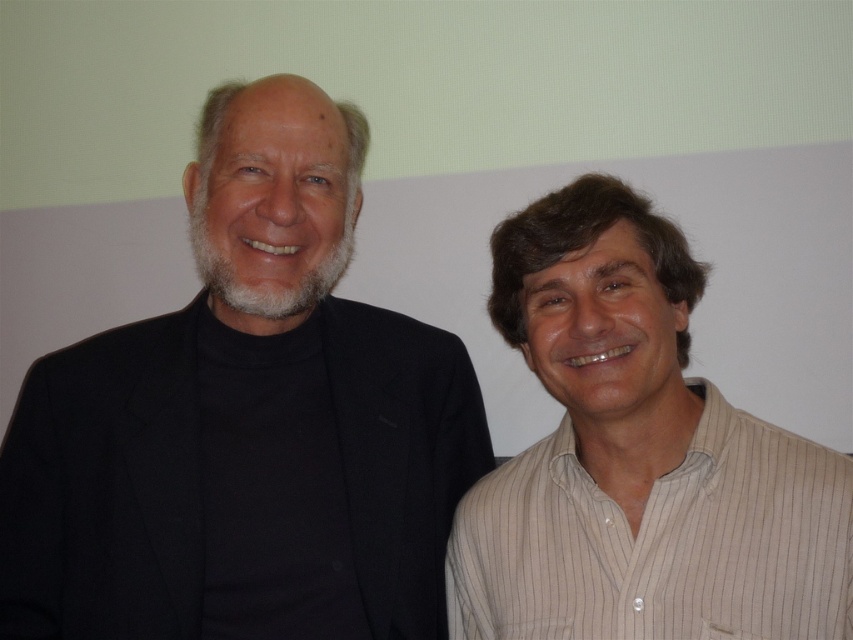
Question: Is black matte suit at left in front of white striped shirt at right?

Choices:
 (A) yes
 (B) no

Answer: (B)

Question: Can you confirm if black matte suit at left is bigger than white striped shirt at right?

Choices:
 (A) no
 (B) yes

Answer: (B)

Question: Which point appears closest to the camera in this image?

Choices:
 (A) (321, 237)
 (B) (798, 461)

Answer: (B)

Question: Among these points, which one is farthest from the camera?

Choices:
 (A) (323, 131)
 (B) (734, 467)

Answer: (A)

Question: Can you confirm if black matte suit at left is positioned below white striped shirt at right?

Choices:
 (A) yes
 (B) no

Answer: (B)